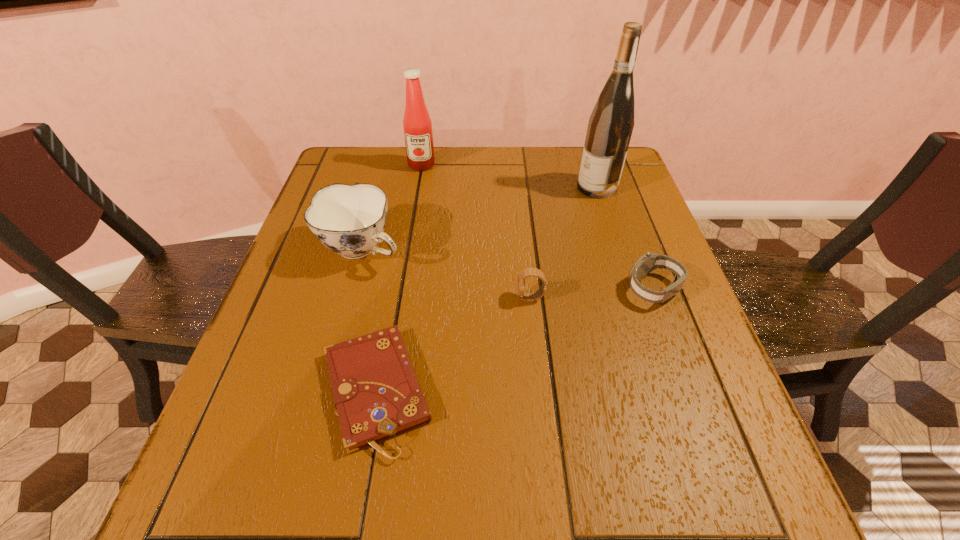
I want to click on free space located 0.210m on the front-facing side of the condiment, so click(413, 217).

I want to click on free space located on the back of the chinaware, so click(379, 187).

The width and height of the screenshot is (960, 540). I want to click on free space located on the face of the fourth object from left to right, so click(331, 298).

The width and height of the screenshot is (960, 540). In order to click on free space located on the face of the fourth object from left to right in this screenshot , I will do `click(401, 298)`.

Where is `free location located 0.110m on the face of the fourth object from left to right`? free location located 0.110m on the face of the fourth object from left to right is located at coordinates (467, 298).

You are a GUI agent. You are given a task and a screenshot of the screen. Output one action in this format:
    pyautogui.click(x=<x>, y=<y>)
    Task: Click on the vacant region located on the face of the right watch
    This screenshot has height=540, width=960.
    Given the screenshot: What is the action you would take?
    pyautogui.click(x=540, y=289)

Identify the location of vacant area situated on the face of the right watch. This screenshot has width=960, height=540. (595, 289).

The width and height of the screenshot is (960, 540). I want to click on free point located 0.300m on the face of the right watch, so (490, 289).

At what (x,y) coordinates should I click in order to perform the action: click on free space located on the right of the notebook. Please return your answer as a coordinate pair (x, y). The width and height of the screenshot is (960, 540). Looking at the image, I should click on (623, 390).

Image resolution: width=960 pixels, height=540 pixels. I want to click on wine bottle that is positioned at the far edge, so click(x=610, y=126).